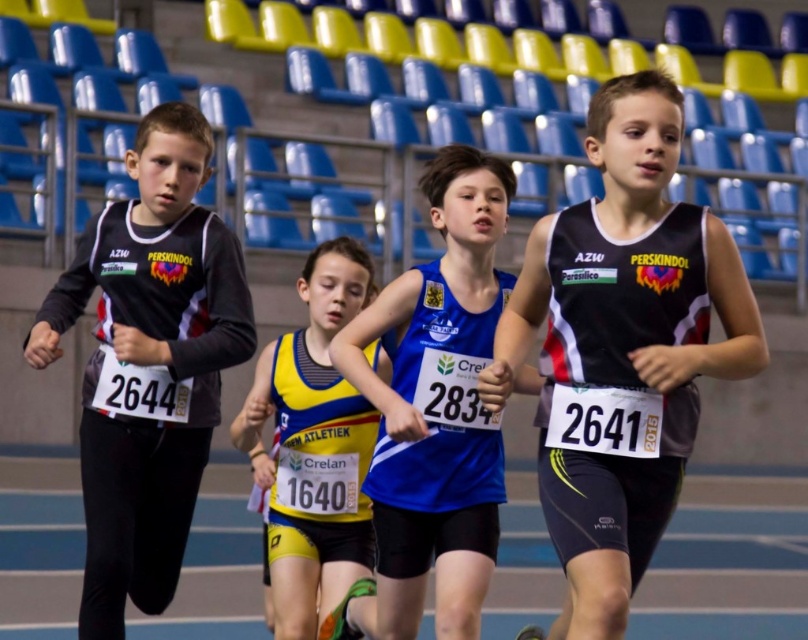
Question: Estimate the real-world distances between objects in this image. Which object is closer to the matte black long-sleeve shirt at left?

Choices:
 (A) black mesh tank top at right
 (B) blue fabric running suit at center

Answer: (B)

Question: Which of the following is the closest to the observer?

Choices:
 (A) yellow and black jersey at center
 (B) matte black long-sleeve shirt at left

Answer: (B)

Question: Can you confirm if black mesh tank top at right is positioned to the right of blue fabric running suit at center?

Choices:
 (A) no
 (B) yes

Answer: (B)

Question: Which of these objects is positioned closest to the yellow and black jersey at center?

Choices:
 (A) blue fabric running suit at center
 (B) matte black long-sleeve shirt at left

Answer: (A)

Question: Can you confirm if black mesh tank top at right is smaller than matte black long-sleeve shirt at left?

Choices:
 (A) no
 (B) yes

Answer: (A)

Question: Can you confirm if black mesh tank top at right is wider than blue fabric running suit at center?

Choices:
 (A) yes
 (B) no

Answer: (A)